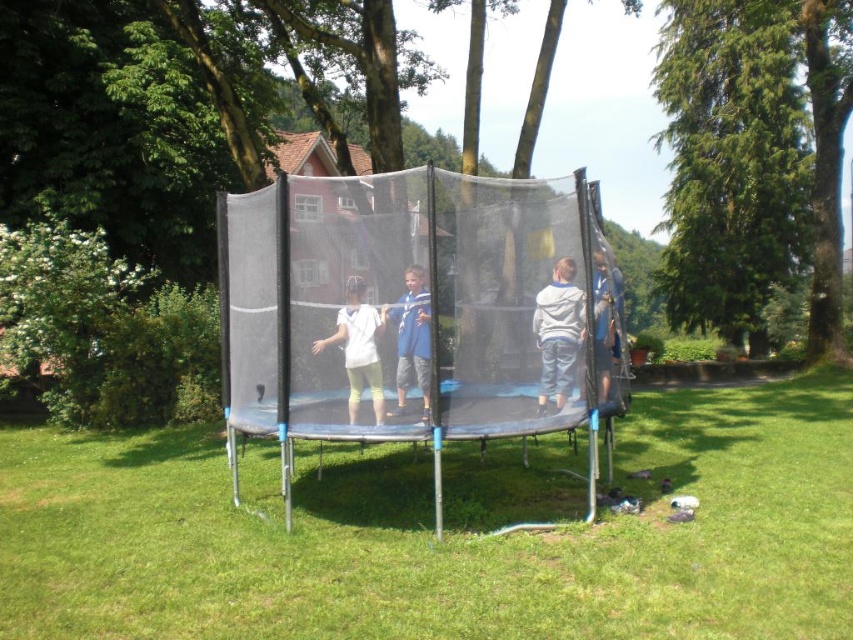
Question: Does black mesh net at center have a greater width compared to blue cotton shirt at center?

Choices:
 (A) no
 (B) yes

Answer: (B)

Question: Which of these objects is positioned farthest from the white matte shirt at center?

Choices:
 (A) gray fleece jacket at center
 (B) blue cotton shirt at center

Answer: (A)

Question: Does white matte shirt at center appear under blue cotton shirt at center?

Choices:
 (A) no
 (B) yes

Answer: (B)

Question: Which object is closer to the camera taking this photo?

Choices:
 (A) blue cotton shirt at center
 (B) gray fleece jacket at center
 (C) white matte shirt at center
 (D) black mesh net at center

Answer: (D)

Question: Is black rubber trampoline at center wider than black mesh net at center?

Choices:
 (A) no
 (B) yes

Answer: (B)

Question: Which object is closer to the camera taking this photo?

Choices:
 (A) black rubber trampoline at center
 (B) white matte shirt at center
 (C) gray fleece jacket at center

Answer: (A)